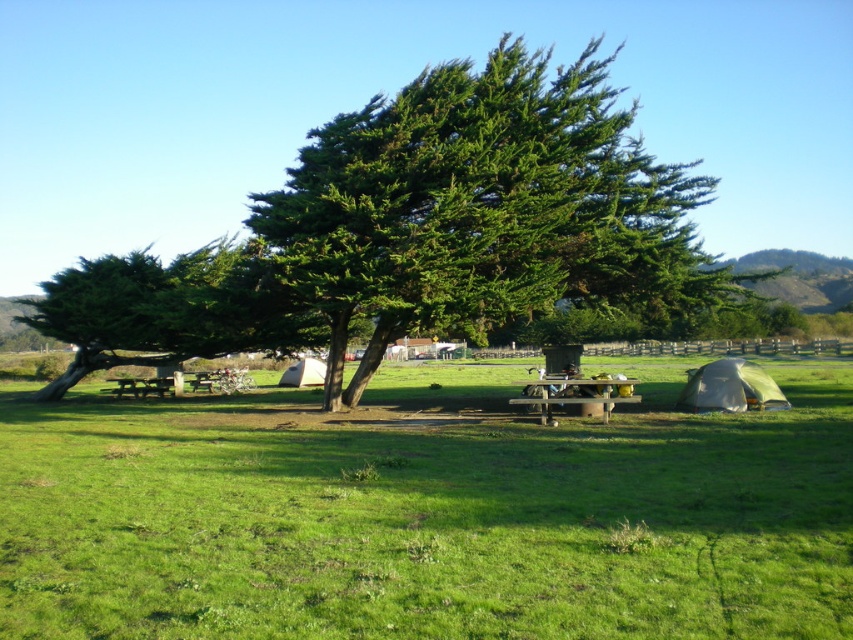
Question: Can you confirm if green fabric tent at lower right is positioned to the left of wooden picnic table at center?

Choices:
 (A) yes
 (B) no

Answer: (B)

Question: Observing the image, what is the correct spatial positioning of green leafy tree at center in reference to white canvas tent at center?

Choices:
 (A) below
 (B) above

Answer: (B)

Question: Which point appears farthest from the camera in this image?

Choices:
 (A) (718, 394)
 (B) (544, 410)

Answer: (A)

Question: Estimate the real-world distances between objects in this image. Which object is closer to the green leafy tree at center?

Choices:
 (A) green grassy field at center
 (B) green fabric tent at lower right
 (C) wooden picnic table at center

Answer: (A)

Question: Which of these objects is positioned closest to the white canvas tent at center?

Choices:
 (A) green leafy tree at center
 (B) green grassy field at center
 (C) green fabric tent at lower right
 (D) wooden picnic table at center

Answer: (B)

Question: In this image, where is green grassy field at center located relative to green fabric tent at lower right?

Choices:
 (A) above
 (B) below

Answer: (B)